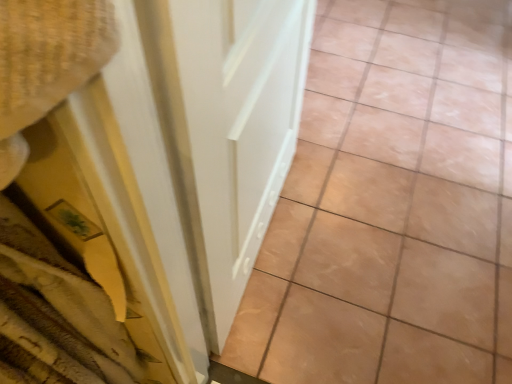
What do you see at coordinates (234, 129) in the screenshot? I see `white glossy door at center` at bounding box center [234, 129].

Find the location of `white glossy door at center`. white glossy door at center is located at coordinates tap(234, 129).

Measure the distance between point (x=309, y=192) and camera.

Point (x=309, y=192) is 5.00 feet from camera.

The width and height of the screenshot is (512, 384). Describe the element at coordinates (392, 205) in the screenshot. I see `beige glossy tile at center` at that location.

Locate an element on the screen. Image resolution: width=512 pixels, height=384 pixels. beige glossy tile at center is located at coordinates (392, 205).

In order to face beige glossy tile at center, should I rotate leftwards or rightwards?

A 17.688 degree turn to the right will do.

Locate an element on the screen. This screenshot has width=512, height=384. white glossy door at center is located at coordinates (234, 129).

Is white glossy door at center at the left side of beige glossy tile at center?

Indeed, white glossy door at center is positioned on the left side of beige glossy tile at center.

Relative to beige glossy tile at center, is white glossy door at center in front or behind?

Clearly, white glossy door at center is in front of beige glossy tile at center.

Which is in front, point (276, 49) or point (504, 224)?

The point (276, 49) is more forward.

From the image's perspective, who appears lower, white glossy door at center or beige glossy tile at center?

white glossy door at center is shown below in the image.

From a real-world perspective, which object stands above the other?

white glossy door at center, from a real-world perspective.

Looking at their sizes, would you say white glossy door at center is wider or thinner than beige glossy tile at center?

Clearly, white glossy door at center has less width compared to beige glossy tile at center.

Considering the sizes of objects white glossy door at center and beige glossy tile at center in the image provided, who is taller, white glossy door at center or beige glossy tile at center?

Standing taller between the two is white glossy door at center.

Between white glossy door at center and beige glossy tile at center, which one has smaller size?

white glossy door at center is smaller.

Do you think white glossy door at center is within beige glossy tile at center, or outside of it?

white glossy door at center exists outside the volume of beige glossy tile at center.

Is white glossy door at center with beige glossy tile at center?

No.

Could you tell me if white glossy door at center is facing beige glossy tile at center?

No, white glossy door at center does not turn towards beige glossy tile at center.

Identify the location of door below the beige glossy tile at center (from the image's perspective). (234, 129).

Consider the image. Is beige glossy tile at center at the right side of white glossy door at center?

Yes.

Between beige glossy tile at center and white glossy door at center, which one is positioned in front?

Positioned in front is white glossy door at center.

Between point (496, 44) and point (209, 151), which one is positioned behind?

Positioned behind is point (496, 44).

From the image's perspective, which one is positioned higher, beige glossy tile at center or white glossy door at center?

beige glossy tile at center, from the image's perspective.

From a real-world perspective, is beige glossy tile at center over white glossy door at center?

Actually, beige glossy tile at center is physically below white glossy door at center in the real world.

Which of these two, beige glossy tile at center or white glossy door at center, is thinner?

white glossy door at center.

In terms of height, does beige glossy tile at center look taller or shorter compared to white glossy door at center?

Clearly, beige glossy tile at center is shorter compared to white glossy door at center.

Is beige glossy tile at center smaller than white glossy door at center?

No, beige glossy tile at center is not smaller than white glossy door at center.

Is beige glossy tile at center inside or outside of white glossy door at center?

beige glossy tile at center is spatially situated outside white glossy door at center.

Is beige glossy tile at center not near white glossy door at center?

They are positioned close to each other.

Consider the image. Is beige glossy tile at center oriented towards white glossy door at center?

No, beige glossy tile at center is not aimed at white glossy door at center.

In the image, there is a beige glossy tile at center. Where is `door below it (from the image's perspective)`? door below it (from the image's perspective) is located at coordinates (234, 129).

The height and width of the screenshot is (384, 512). What are the coordinates of `ceramic tile on the right of white glossy door at center` in the screenshot? It's located at (392, 205).

The image size is (512, 384). In order to click on door above the beige glossy tile at center (from a real-world perspective) in this screenshot , I will do `click(234, 129)`.